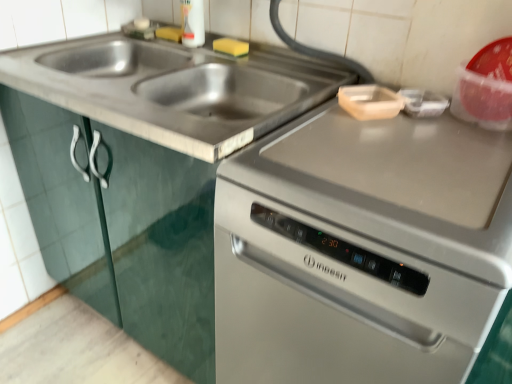
Question: Is wooden cutting board at upper right at the right side of stainless steel dishwasher at center?

Choices:
 (A) no
 (B) yes

Answer: (B)

Question: Is wooden cutting board at upper right outside stainless steel dishwasher at center?

Choices:
 (A) no
 (B) yes

Answer: (B)

Question: From the image's perspective, is wooden cutting board at upper right located beneath stainless steel dishwasher at center?

Choices:
 (A) yes
 (B) no

Answer: (B)

Question: Can you confirm if wooden cutting board at upper right is shorter than stainless steel dishwasher at center?

Choices:
 (A) yes
 (B) no

Answer: (A)

Question: From the image's perspective, is wooden cutting board at upper right above stainless steel dishwasher at center?

Choices:
 (A) no
 (B) yes

Answer: (B)

Question: Considering the relative positions of wooden cutting board at upper right and stainless steel dishwasher at center in the image provided, is wooden cutting board at upper right to the left of stainless steel dishwasher at center from the viewer's perspective?

Choices:
 (A) no
 (B) yes

Answer: (A)

Question: Is stainless steel dishwasher at center thinner than stainless steel sink at upper left?

Choices:
 (A) no
 (B) yes

Answer: (B)

Question: Is stainless steel dishwasher at center not inside stainless steel sink at upper left?

Choices:
 (A) no
 (B) yes

Answer: (B)

Question: Can you confirm if stainless steel dishwasher at center is taller than stainless steel sink at upper left?

Choices:
 (A) yes
 (B) no

Answer: (A)

Question: Can you confirm if stainless steel dishwasher at center is bigger than stainless steel sink at upper left?

Choices:
 (A) no
 (B) yes

Answer: (B)

Question: Is the position of stainless steel dishwasher at center more distant than that of stainless steel sink at upper left?

Choices:
 (A) yes
 (B) no

Answer: (A)

Question: From the image's perspective, is stainless steel dishwasher at center on top of stainless steel sink at upper left?

Choices:
 (A) no
 (B) yes

Answer: (A)

Question: Is stainless steel dishwasher at center facing towards satin silver oven at right?

Choices:
 (A) no
 (B) yes

Answer: (A)